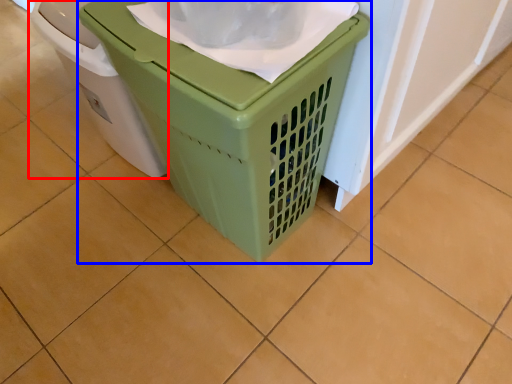
Question: Which object appears farthest to the camera in this image, waste container (highlighted by a red box) or waste container (highlighted by a blue box)?

Choices:
 (A) waste container
 (B) waste container

Answer: (A)